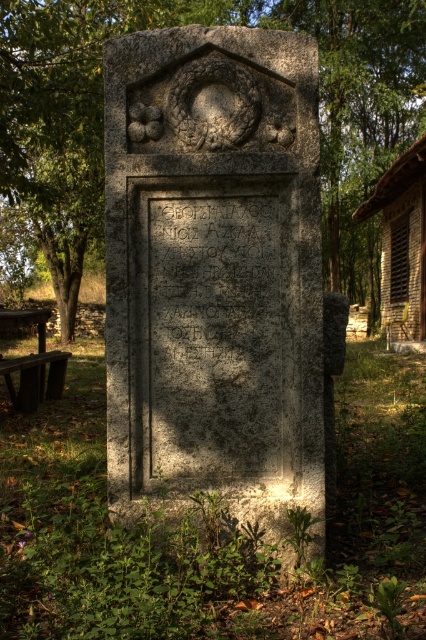
You are a photographer planning to capture the gray stone monument at center and the green leafy tree at upper left in a single frame. Based on their sizes in the image, which object should you focus on to ensure both are visible without cropping?

The gray stone monument at center occupies less space than the green leafy tree at upper left, so you should focus on the green leafy tree at upper left to ensure both are visible without cropping.

You are standing at the point marked by the coordinates (215, 272) in the image. Based on the scene description, what object are you directly facing?

The point at coordinates (215, 272) corresponds to the gray stone monument at center, so you are directly facing the gray stone monument at center.